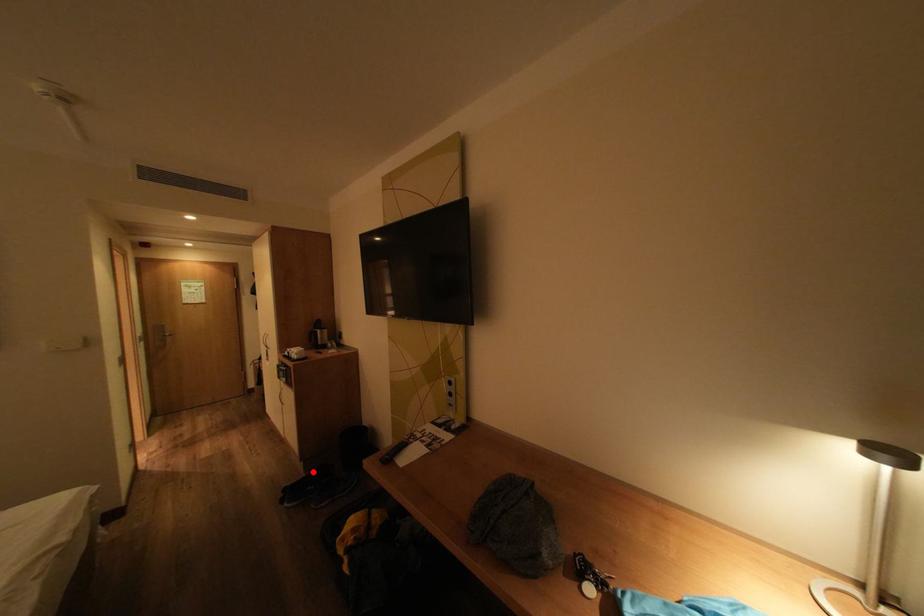
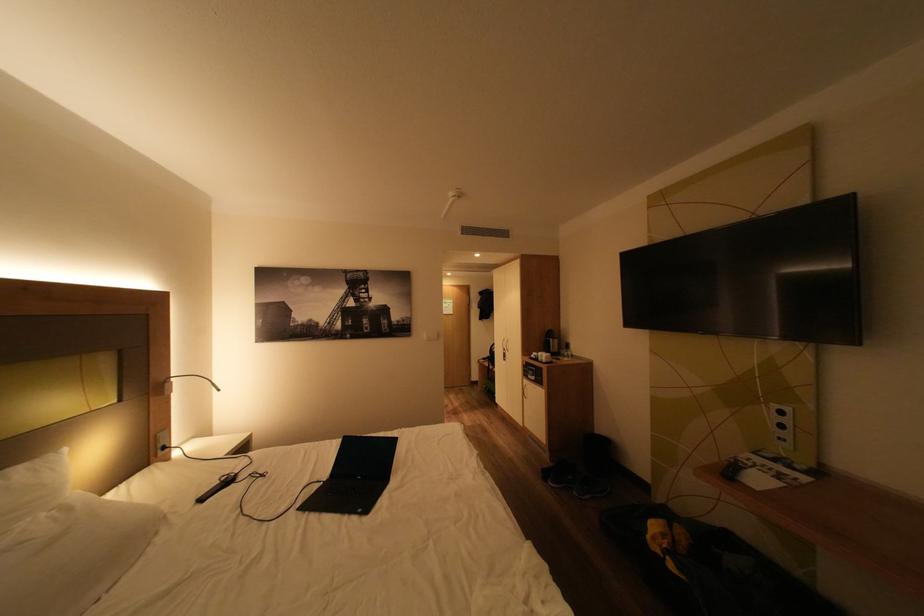
In the second image, find the point that corresponds to the highlighted location in the first image.

(560, 461)